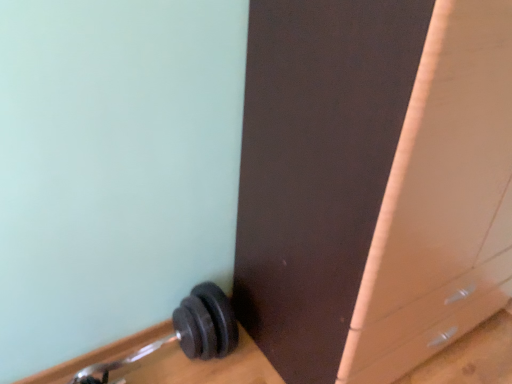
This screenshot has width=512, height=384. What do you see at coordinates (442, 201) in the screenshot?
I see `matte brown file cabinet at lower right` at bounding box center [442, 201].

Identify the location of matte brown file cabinet at lower right. This screenshot has width=512, height=384. (442, 201).

In the scene shown: What is the approximate height of black rubber dumbbell at lower left?

black rubber dumbbell at lower left is 2.20 inches in height.

At what (x,y) coordinates should I click in order to perform the action: click on black rubber dumbbell at lower left. Please return your answer as a coordinate pair (x, y). Image resolution: width=512 pixels, height=384 pixels. Looking at the image, I should click on (184, 333).

The width and height of the screenshot is (512, 384). What do you see at coordinates (184, 333) in the screenshot? I see `black rubber dumbbell at lower left` at bounding box center [184, 333].

This screenshot has height=384, width=512. Identify the location of matte brown file cabinet at lower right. point(442,201).

Which object is positioned more to the right, black rubber dumbbell at lower left or matte brown file cabinet at lower right?

From the viewer's perspective, matte brown file cabinet at lower right appears more on the right side.

Does black rubber dumbbell at lower left come behind matte brown file cabinet at lower right?

That is True.

Which is nearer, [174,338] or [449,320]?

The point [449,320] is more forward.

From the image's perspective, which one is positioned higher, black rubber dumbbell at lower left or matte brown file cabinet at lower right?

matte brown file cabinet at lower right, from the image's perspective.

From a real-world perspective, between black rubber dumbbell at lower left and matte brown file cabinet at lower right, who is vertically lower?

black rubber dumbbell at lower left, from a real-world perspective.

Between black rubber dumbbell at lower left and matte brown file cabinet at lower right, which one has larger width?

With larger width is matte brown file cabinet at lower right.

Can you confirm if black rubber dumbbell at lower left is shorter than matte brown file cabinet at lower right?

Yes, black rubber dumbbell at lower left is shorter than matte brown file cabinet at lower right.

Which of these two, black rubber dumbbell at lower left or matte brown file cabinet at lower right, is bigger?

matte brown file cabinet at lower right is bigger.

Is matte brown file cabinet at lower right completely or partially inside black rubber dumbbell at lower left?

That's incorrect, matte brown file cabinet at lower right is not inside black rubber dumbbell at lower left.

Are black rubber dumbbell at lower left and matte brown file cabinet at lower right beside each other?

No.

Could you tell me if black rubber dumbbell at lower left is turned towards matte brown file cabinet at lower right?

No, black rubber dumbbell at lower left does not turn towards matte brown file cabinet at lower right.

Measure the distance between black rubber dumbbell at lower left and matte brown file cabinet at lower right.

black rubber dumbbell at lower left is 26.09 inches from matte brown file cabinet at lower right.

Image resolution: width=512 pixels, height=384 pixels. I want to click on file cabinet on the right of black rubber dumbbell at lower left, so click(x=442, y=201).

Between matte brown file cabinet at lower right and black rubber dumbbell at lower left, which one appears on the left side from the viewer's perspective?

black rubber dumbbell at lower left.

Is matte brown file cabinet at lower right closer to the viewer compared to black rubber dumbbell at lower left?

Yes, matte brown file cabinet at lower right is in front of black rubber dumbbell at lower left.

Which point is more distant from viewer, (497,109) or (218,339)?

Positioned behind is point (218,339).

From the image's perspective, would you say matte brown file cabinet at lower right is positioned over black rubber dumbbell at lower left?

Yes, from the image's perspective, matte brown file cabinet at lower right is over black rubber dumbbell at lower left.

From a real-world perspective, who is located higher, matte brown file cabinet at lower right or black rubber dumbbell at lower left?

matte brown file cabinet at lower right.

Can you confirm if matte brown file cabinet at lower right is wider than black rubber dumbbell at lower left?

Indeed, matte brown file cabinet at lower right has a greater width compared to black rubber dumbbell at lower left.

Consider the image. Considering the sizes of objects matte brown file cabinet at lower right and black rubber dumbbell at lower left in the image provided, who is taller, matte brown file cabinet at lower right or black rubber dumbbell at lower left?

With more height is matte brown file cabinet at lower right.

Is matte brown file cabinet at lower right smaller than black rubber dumbbell at lower left?

No.

Do you think matte brown file cabinet at lower right is within black rubber dumbbell at lower left, or outside of it?

matte brown file cabinet at lower right exists outside the volume of black rubber dumbbell at lower left.

Are matte brown file cabinet at lower right and black rubber dumbbell at lower left located far from each other?

No, there isn't a large distance between matte brown file cabinet at lower right and black rubber dumbbell at lower left.

Is matte brown file cabinet at lower right turned away from black rubber dumbbell at lower left?

matte brown file cabinet at lower right does not have its back to black rubber dumbbell at lower left.

How different are the orientations of matte brown file cabinet at lower right and black rubber dumbbell at lower left in degrees?

0.665 degrees separate the facing orientations of matte brown file cabinet at lower right and black rubber dumbbell at lower left.

How far apart are matte brown file cabinet at lower right and black rubber dumbbell at lower left?

The distance of matte brown file cabinet at lower right from black rubber dumbbell at lower left is 26.09 inches.

The image size is (512, 384). In order to click on file cabinet above the black rubber dumbbell at lower left (from a real-world perspective) in this screenshot , I will do (442, 201).

You are a GUI agent. You are given a task and a screenshot of the screen. Output one action in this format:
    pyautogui.click(x=<x>, y=<y>)
    Task: Click on the file cabinet above the black rubber dumbbell at lower left (from the image's perspective)
    
    Given the screenshot: What is the action you would take?
    pyautogui.click(x=442, y=201)

Find the location of a particular element. This screenshot has width=512, height=384. dumbbell lying on the left of matte brown file cabinet at lower right is located at coordinates (184, 333).